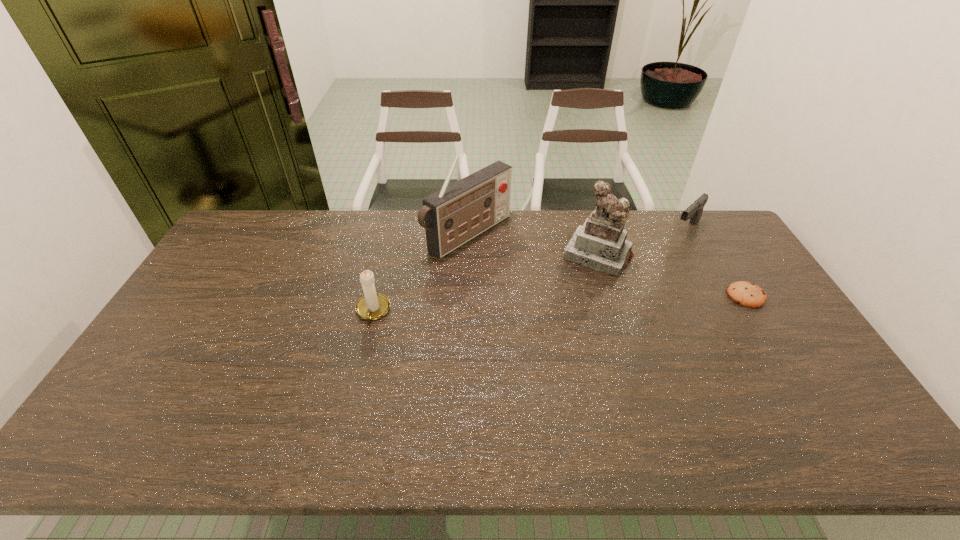
Find the location of a particular element. the leftmost object is located at coordinates (372, 305).

Identify the location of candle holder. (372, 305).

The width and height of the screenshot is (960, 540). Identify the location of cookie. (747, 294).

Identify the location of pistol. (694, 212).

Where is `radio receiver`? radio receiver is located at coordinates (457, 213).

Locate an element on the screen. The width and height of the screenshot is (960, 540). the second tallest object is located at coordinates (600, 244).

Find the location of a particular element. the third object from left to right is located at coordinates (600, 244).

Locate an element on the screen. The height and width of the screenshot is (540, 960). vacant position located on the handle side of the third shortest object is located at coordinates (353, 393).

Locate an element on the screen. vacant area situated 0.060m on the left of the shortest object is located at coordinates (708, 296).

Locate an element on the screen. This screenshot has height=540, width=960. vacant space situated aim along the barrel of the second shortest object is located at coordinates (632, 280).